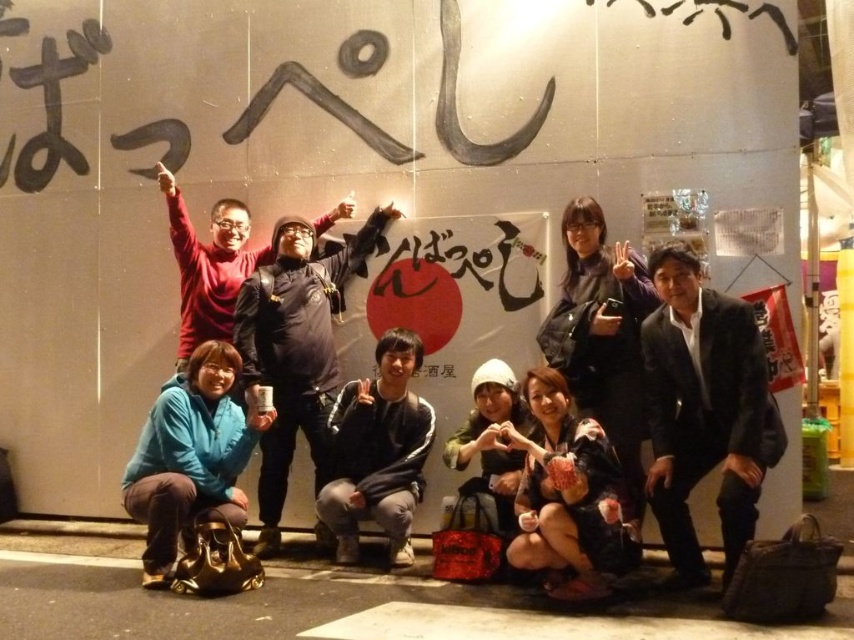
Question: Is black suit at center positioned behind dark blue hoodie at center?

Choices:
 (A) no
 (B) yes

Answer: (A)

Question: Can you confirm if dark blue jacket at center is smaller than dark blue hoodie at center?

Choices:
 (A) yes
 (B) no

Answer: (B)

Question: Among these points, which one is nearest to the camera?

Choices:
 (A) (331, 388)
 (B) (205, 333)

Answer: (A)

Question: In this image, where is dark blue jacket at center located relative to dark blue hoodie at center?

Choices:
 (A) below
 (B) above

Answer: (A)

Question: Which point is closer to the camera taking this photo?

Choices:
 (A) (260, 284)
 (B) (702, 429)

Answer: (B)

Question: Among these points, which one is nearest to the camera?

Choices:
 (A) (206, 276)
 (B) (313, 328)

Answer: (B)